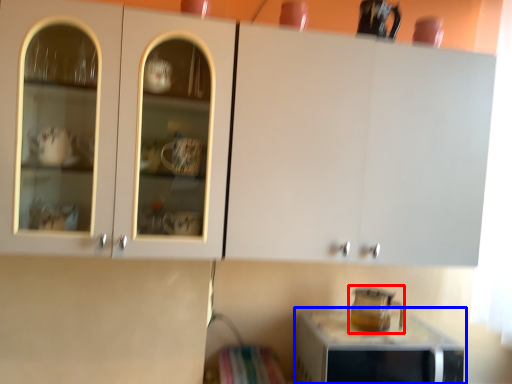
Question: Among these objects, which one is farthest to the camera, appliance (highlighted by a red box) or home appliance (highlighted by a blue box)?

Choices:
 (A) appliance
 (B) home appliance

Answer: (A)